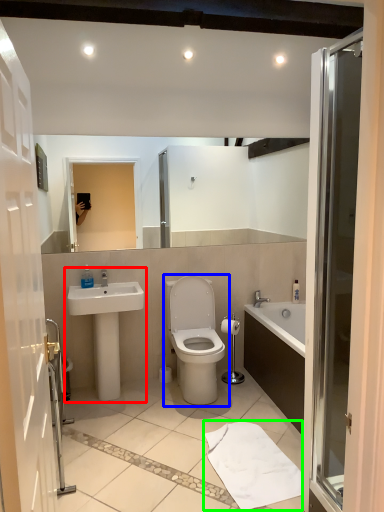
Question: Which is nearer to the sink (highlighted by a red box)? toilet (highlighted by a blue box) or bath towel (highlighted by a green box).

Choices:
 (A) toilet
 (B) bath towel

Answer: (A)